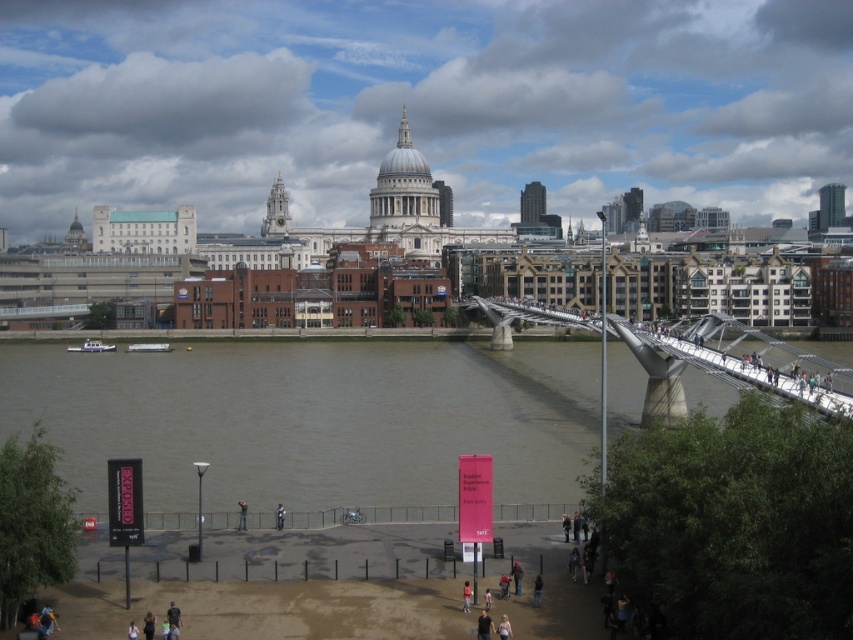
Which is in front, point (300, 468) or point (691, 352)?

Point (300, 468)

Which is more to the left, brown water at lower center or metallic gray bridge at center right?

brown water at lower center is more to the left.

This screenshot has height=640, width=853. I want to click on brown water at lower center, so pos(311,419).

The width and height of the screenshot is (853, 640). I want to click on brown water at lower center, so click(x=311, y=419).